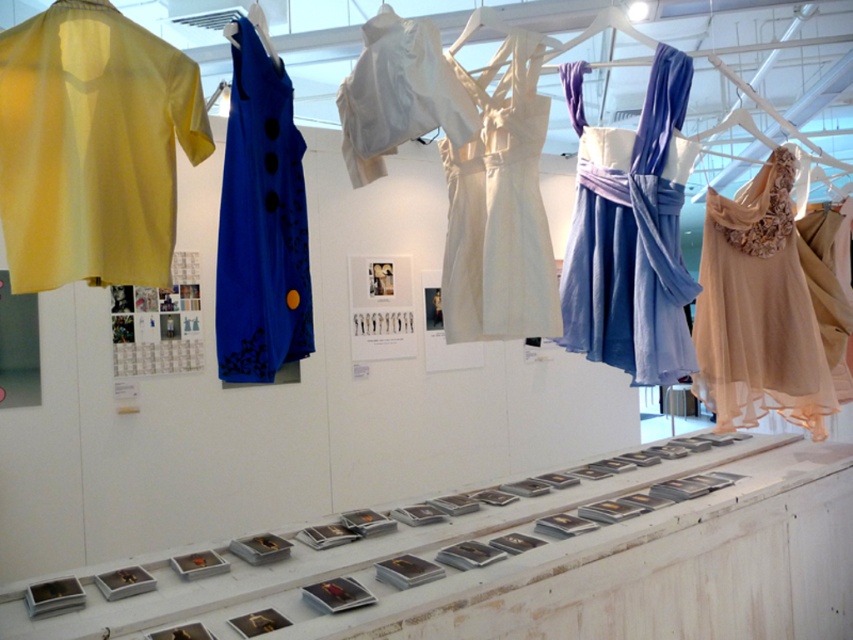
Looking at this image, you are standing in front of the display setup in the gallery. You want to reach the beige chiffon dress at right to examine it closely. Considering your height is 5 feet 6 inches, can you comfortably reach it without needing a stool?

The beige chiffon dress at right is 7.83 feet away from the camera. Since the distance is measured from the camera, not the height, this does not directly indicate if it is within your reach. You should consider the height of the dress instead of the distance to determine if you can reach it comfortably.

You are standing in front of the display setup in the gallery. There is a point marked at coordinates (498, 209). Which garment is located at this point?

The point at coordinates (498, 209) corresponds to the ivory satin dress at center.